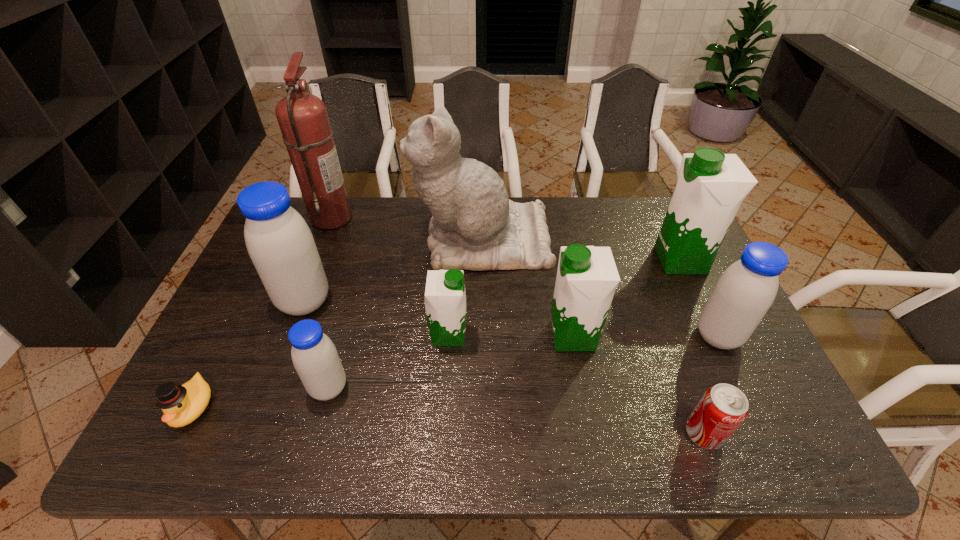
Find the location of a particular element. The width and height of the screenshot is (960, 540). blank area located on the right of the fourth object from left to right is located at coordinates (496, 388).

The height and width of the screenshot is (540, 960). Find the location of `vacant space located 0.080m on the back of the ninth tallest object`. vacant space located 0.080m on the back of the ninth tallest object is located at coordinates (686, 386).

What are the coordinates of `fire extinguisher at the far edge` in the screenshot? It's located at (303, 119).

Find the location of a particular element. cat that is at the far edge is located at coordinates (475, 226).

You are a GUI agent. You are given a task and a screenshot of the screen. Output one action in this format:
    pyautogui.click(x=<x>, y=<y>)
    Task: Click on the soda can located at the near edge
    The height and width of the screenshot is (540, 960).
    Given the screenshot: What is the action you would take?
    pyautogui.click(x=723, y=407)

Where is `duck that is at the near edge`? duck that is at the near edge is located at coordinates (181, 405).

Find the location of `fire extinguisher that is at the left edge`. fire extinguisher that is at the left edge is located at coordinates (303, 119).

Find the location of a particular element. soya milk positioned at the left edge is located at coordinates (280, 244).

Where is `duck that is at the left edge`? duck that is at the left edge is located at coordinates (181, 405).

Locate an element on the screen. This screenshot has width=960, height=540. object located in the far left corner section of the desktop is located at coordinates (303, 119).